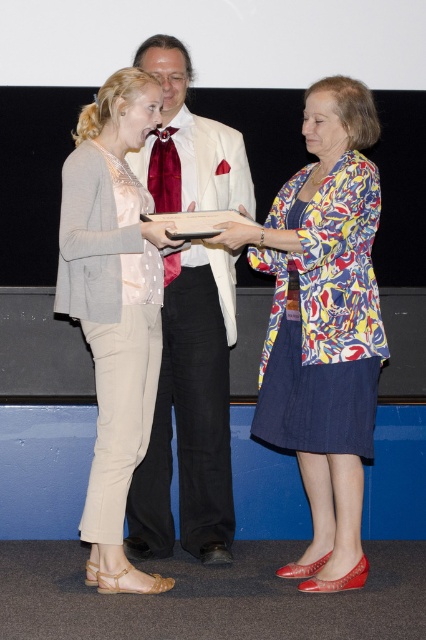
Does printed fabric jacket at center appear over matte white suit at center?

Yes.

What do you see at coordinates (324, 324) in the screenshot? The width and height of the screenshot is (426, 640). I see `printed fabric jacket at center` at bounding box center [324, 324].

Locate an element on the screen. The width and height of the screenshot is (426, 640). printed fabric jacket at center is located at coordinates (324, 324).

Is beige cotton pants at left closer to camera compared to shiny red silk tie at center?

That is True.

Can you confirm if beige cotton pants at left is positioned to the left of shiny red silk tie at center?

Yes, beige cotton pants at left is to the left of shiny red silk tie at center.

Image resolution: width=426 pixels, height=640 pixels. Describe the element at coordinates (114, 307) in the screenshot. I see `beige cotton pants at left` at that location.

Identify the location of beige cotton pants at left. (114, 307).

Which is more to the right, matte white suit at center or shiny red silk tie at center?

matte white suit at center is more to the right.

Can you confirm if matte white suit at center is wider than shiny red silk tie at center?

Yes.

You are a GUI agent. You are given a task and a screenshot of the screen. Output one action in this format:
    pyautogui.click(x=<x>, y=<y>)
    Task: Click on the matte white suit at center
    
    Given the screenshot: What is the action you would take?
    pyautogui.click(x=189, y=413)